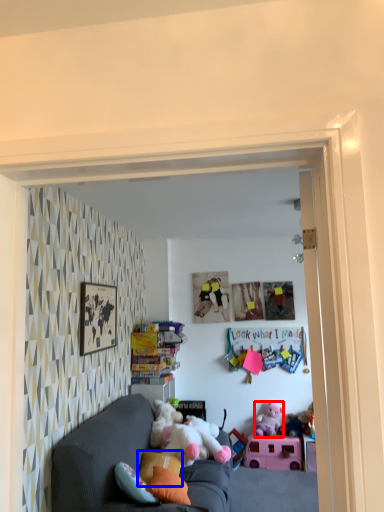
Question: Among these objects, which one is nearest to the camera, toy (highlighted by a red box) or pillow (highlighted by a blue box)?

Choices:
 (A) toy
 (B) pillow

Answer: (B)